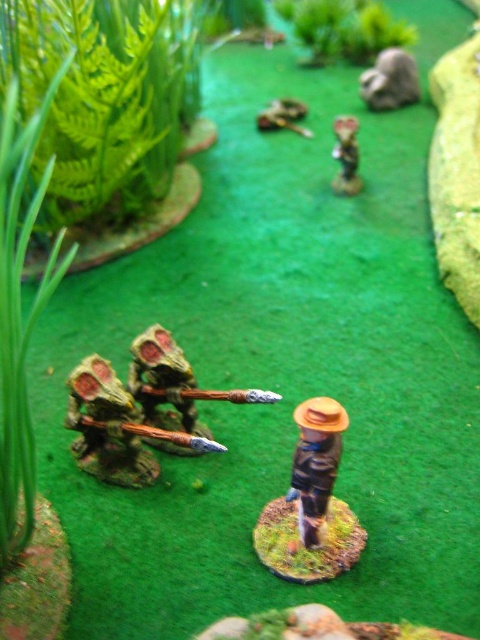
Can you confirm if green mossy spear at lower left is wider than matte gray rock at upper center?

Yes, green mossy spear at lower left is wider than matte gray rock at upper center.

Is point (117, 397) farther from camera compared to point (404, 67)?

No, it is in front of (404, 67).

Identify the location of green mossy spear at lower left. (117, 428).

Does point (92, 378) come behind point (305, 132)?

No, it is not.

Does green mossy spear at lower left appear under green matte snake at upper center?

Indeed, green mossy spear at lower left is positioned under green matte snake at upper center.

Which is behind, point (149, 461) or point (282, 100)?

The point (282, 100) is more distant.

Identify the location of green mossy spear at lower left. (117, 428).

Does wooden figure at center appear on the right side of green matte snake at upper center?

In fact, wooden figure at center is to the left of green matte snake at upper center.

Is point (338, 404) in front of point (296, 102)?

Yes, point (338, 404) is in front of point (296, 102).

At what (x,y) coordinates should I click in order to perform the action: click on wooden figure at center. Please return your answer as a coordinate pair (x, y). This screenshot has height=640, width=480. Looking at the image, I should click on (315, 461).